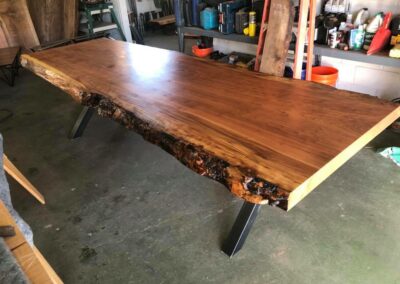
Where is `white cabinet`? The image size is (400, 284). white cabinet is located at coordinates (364, 73), (245, 48).